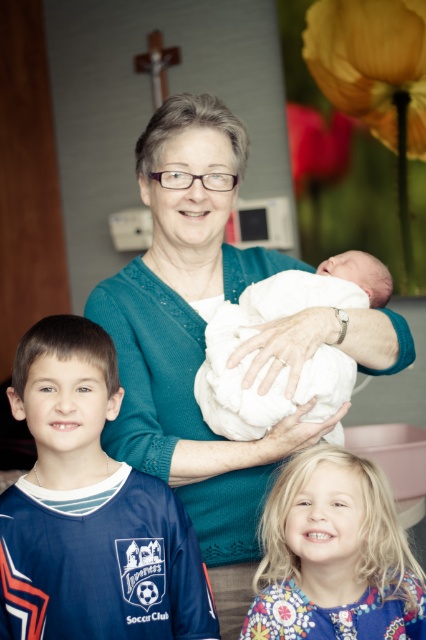
Describe the element at coordinates (334, 561) in the screenshot. The image size is (426, 640). I see `blonde hair at center` at that location.

Does blonde hair at center have a greater height compared to white soft cloth at center?

No.

Between point (299, 488) and point (325, 282), which one is positioned in front?

Point (299, 488) is in front.

Where is `blonde hair at center`? blonde hair at center is located at coordinates (334, 561).

I want to click on teal knitted sweater at center, so click(192, 340).

Between point (233, 536) and point (275, 582), which one is positioned behind?

Point (233, 536)

Describe the element at coordinates (192, 340) in the screenshot. The image size is (426, 640). I see `teal knitted sweater at center` at that location.

Locate an element on the screen. This screenshot has height=640, width=426. teal knitted sweater at center is located at coordinates (192, 340).

Which is in front, point (25, 573) or point (299, 512)?

Point (25, 573) is in front.

Measure the distance from blue jersey at center to blonde hair at center.

blue jersey at center is 10.88 inches from blonde hair at center.

Which is in front, point (184, 515) or point (307, 564)?

Point (184, 515) is in front.

The image size is (426, 640). Find the location of `blue jersey at center`. blue jersey at center is located at coordinates (89, 509).